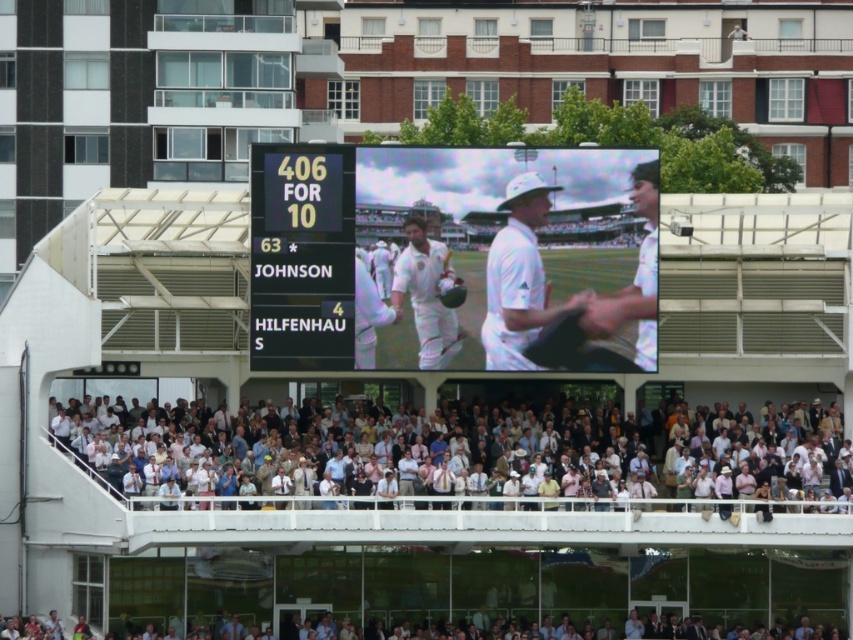
Question: Is white cotton crowd at lower center below yellow digital scoreboard at center?

Choices:
 (A) no
 (B) yes

Answer: (B)

Question: Which object is the farthest from the white clothed man at center?

Choices:
 (A) yellow digital scoreboard at center
 (B) white cotton crowd at lower center

Answer: (B)

Question: Does yellow digital scoreboard at center appear over white clothed man at center?

Choices:
 (A) yes
 (B) no

Answer: (A)

Question: Which object appears farthest from the camera in this image?

Choices:
 (A) white cotton crowd at lower center
 (B) white matte cricket helmet at center

Answer: (B)

Question: Which point appears closest to the camera in this image?

Choices:
 (A) (741, 448)
 (B) (65, 634)
 (C) (648, 304)

Answer: (B)

Question: From the image, what is the correct spatial relationship of white cotton crowd at lower center in relation to light beige fabric crowd at lower center?

Choices:
 (A) right
 (B) left

Answer: (A)